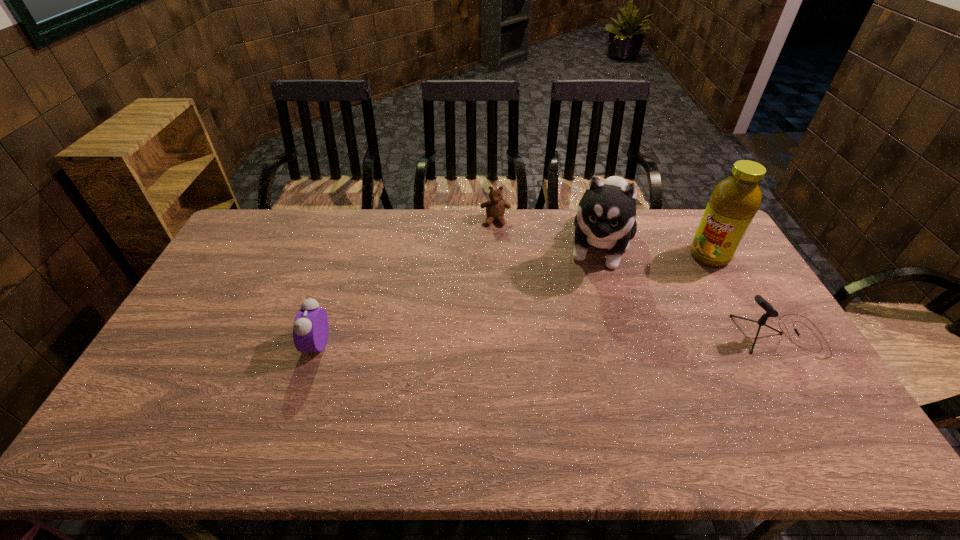
Where is `vacant space that satisfies the following two spatial constraints: 1. on the front side of the microphone; 2. on the stand of the fruit juice`? The width and height of the screenshot is (960, 540). vacant space that satisfies the following two spatial constraints: 1. on the front side of the microphone; 2. on the stand of the fruit juice is located at coordinates (755, 335).

Where is `blank space that satisfies the following two spatial constraints: 1. on the front side of the fourth object from right to left; 2. on the stand of the microphone`? This screenshot has height=540, width=960. blank space that satisfies the following two spatial constraints: 1. on the front side of the fourth object from right to left; 2. on the stand of the microphone is located at coordinates (500, 335).